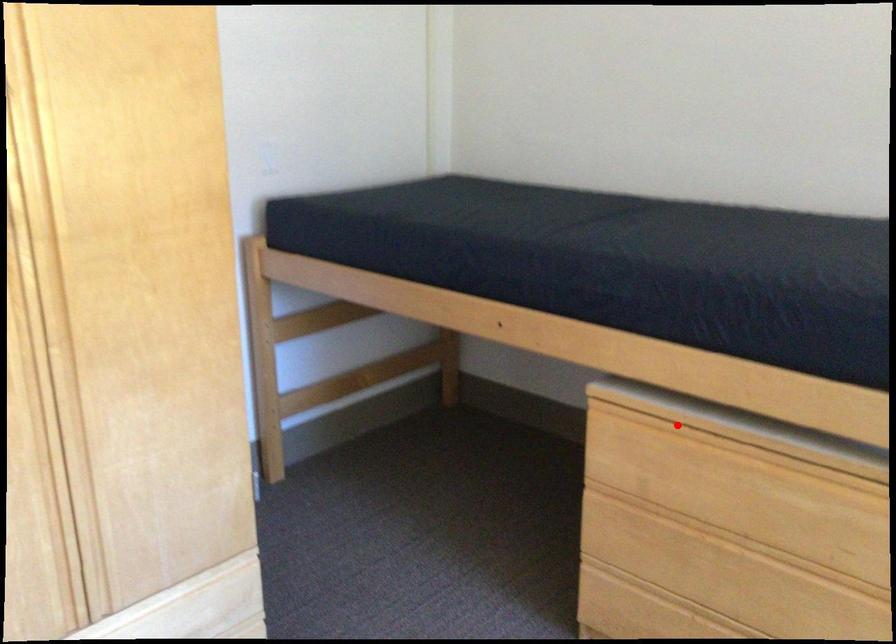
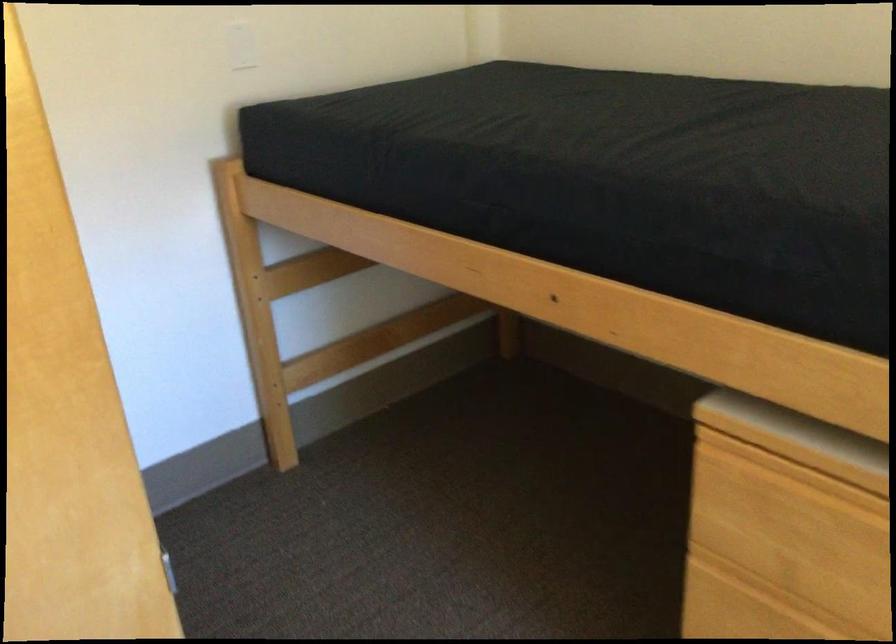
Question: A red point is marked in image1. In image2, is the corresponding 3D point closer to the camera or farther? Reply with the corresponding letter.

Choices:
 (A) The corresponding 3D point is closer.
 (B) The corresponding 3D point is farther.

Answer: (A)